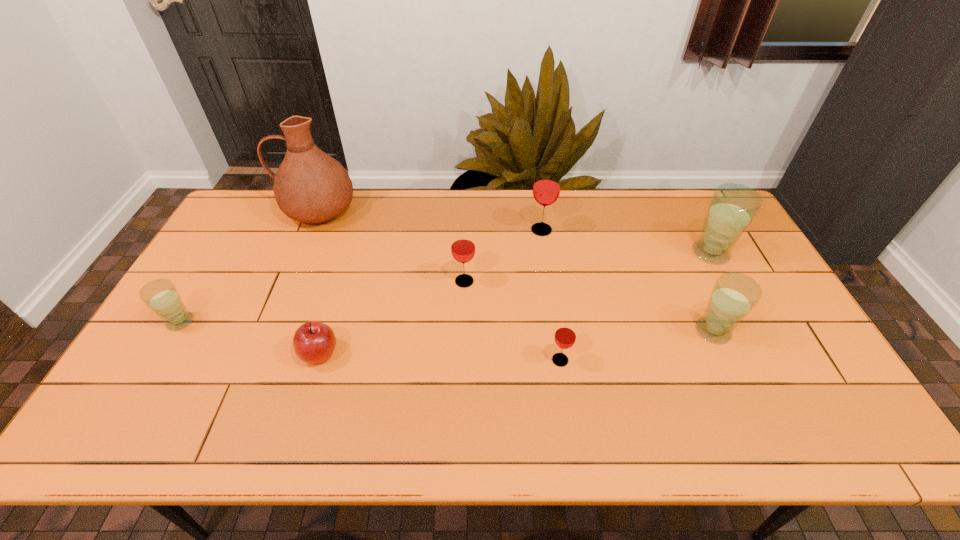
Where is `vacant space at the left edge of the desktop`? vacant space at the left edge of the desktop is located at coordinates (259, 240).

Find the location of a particular element. The width and height of the screenshot is (960, 540). free space at the right edge of the desktop is located at coordinates (786, 370).

At what (x,y) coordinates should I click in order to perform the action: click on free space at the far right corner of the desktop. Please return your answer as a coordinate pair (x, y). Image resolution: width=960 pixels, height=540 pixels. Looking at the image, I should click on (687, 228).

At what (x,y) coordinates should I click in order to perform the action: click on unoccupied area between the biggest red glass and the apple. Please return your answer as a coordinate pair (x, y). The width and height of the screenshot is (960, 540). Looking at the image, I should click on (430, 292).

This screenshot has width=960, height=540. I want to click on free space between the shortest object and the leftmost red glass, so click(392, 318).

The height and width of the screenshot is (540, 960). What are the coordinates of `vacant space that is in between the shortest object and the fourth nearest glass` in the screenshot? It's located at (392, 318).

This screenshot has height=540, width=960. Identify the location of free area in between the farthest red glass and the leftmost blue glass. 361,276.

The image size is (960, 540). In order to click on free spot between the biggest red glass and the tallest object in this screenshot , I will do `click(430, 220)`.

Locate an element on the screen. The width and height of the screenshot is (960, 540). free area in between the leftmost red glass and the nearest glass is located at coordinates (513, 321).

You are a GUI agent. You are given a task and a screenshot of the screen. Output one action in this format:
    pyautogui.click(x=<x>, y=<y>)
    Task: Click on the free area in between the farthest red glass and the farthest blue glass
    The width and height of the screenshot is (960, 540).
    Given the screenshot: What is the action you would take?
    pyautogui.click(x=626, y=241)